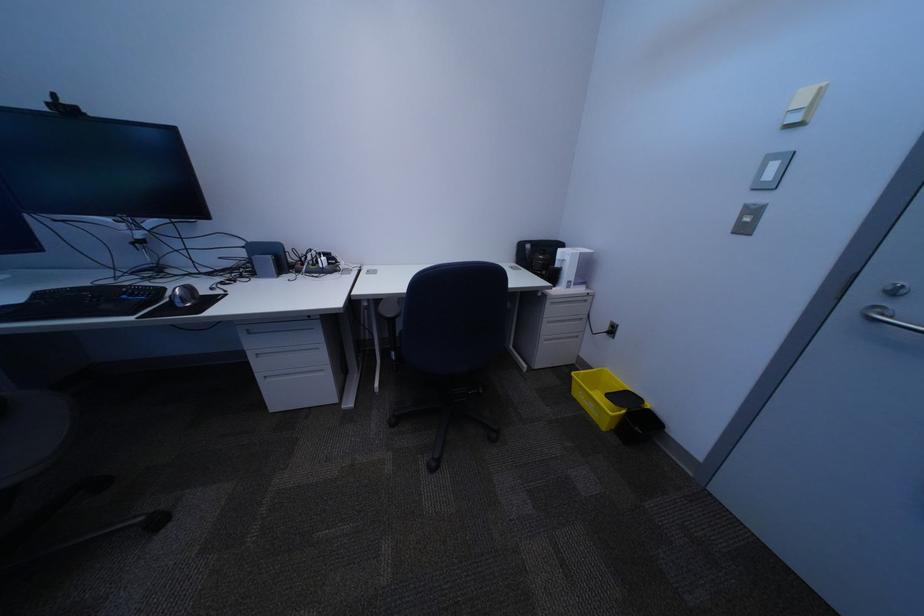
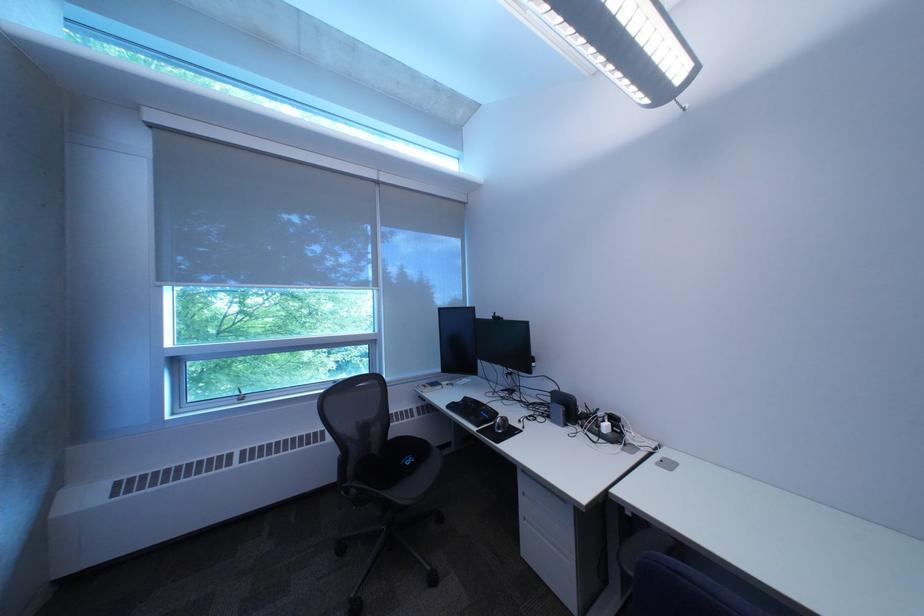
Where in the second image is the point corresponding to (275,368) from the first image?

(541, 506)